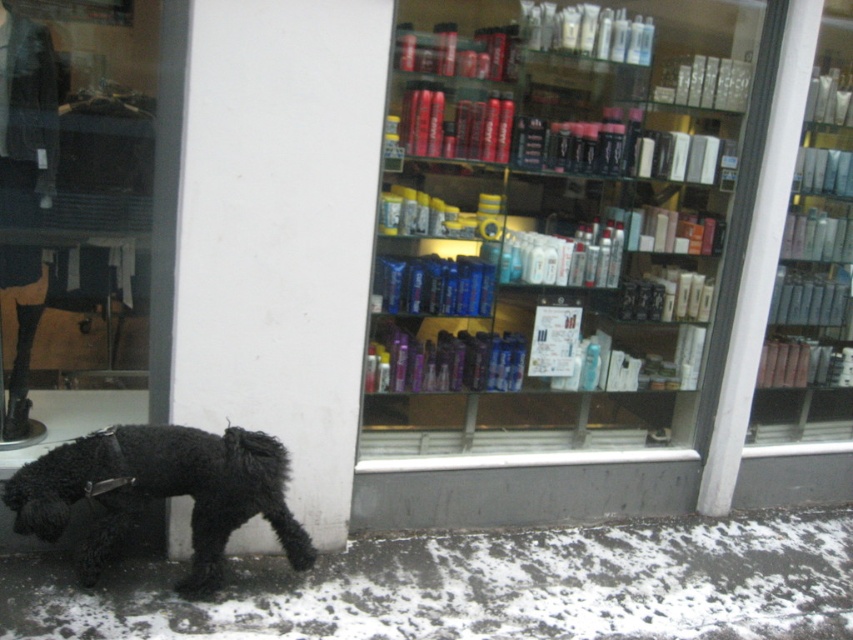
You are a customer standing outside the store looking at the storefront window display. You notice the translucent glass shelves at center and the black fuzzy dog at lower left. Which object is higher up in the image?

The translucent glass shelves at center are higher up in the image than the black fuzzy dog at lower left because the shelves are located above the dog.

You are a delivery person trying to place a new shipment of hair care products on the shelves inside the store. The store manager has specified that the new items must be placed at the exact coordinates of the translucent glass shelves at center. What are the coordinates where you should place the items?

The translucent glass shelves at center are located at coordinates point (553,225), so you should place the new items there.

You are a customer standing in front of the storefront. You want to pick up a shampoo bottle from the translucent glass shelves at center but need to avoid stepping on the black fuzzy dog at lower left. Can you reach the shelves without moving the dog?

The translucent glass shelves at center are further to the viewer than the black fuzzy dog at lower left, meaning the shelves are closer to you. Since the shelves are closer, you can reach them without needing to move the dog, which is farther away.